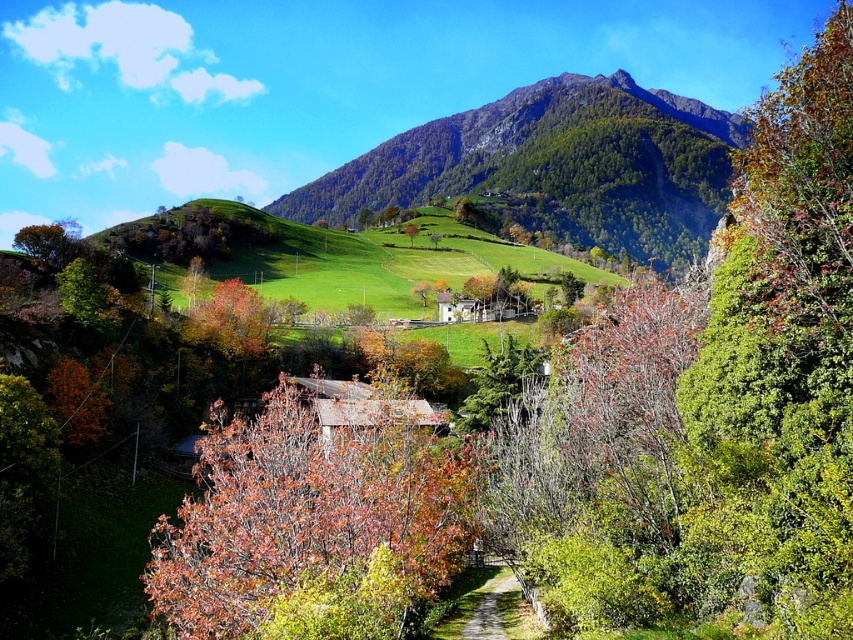
Is brown matte tree at center smaller than green grassy path at center?

Incorrect, brown matte tree at center is not smaller in size than green grassy path at center.

Between brown matte tree at center and green grassy path at center, which one has less height?

green grassy path at center is shorter.

Is point (357, 586) farther from viewer compared to point (495, 602)?

No, it is not.

This screenshot has height=640, width=853. Identify the location of brown matte tree at center. (312, 525).

Is point (73, 371) less distant than point (410, 224)?

Yes, it is in front of point (410, 224).

Is point (97, 387) positioned in front of point (410, 234)?

Yes.

You are a GUI agent. You are given a task and a screenshot of the screen. Output one action in this format:
    pyautogui.click(x=<x>, y=<y>)
    Task: Click on the orange matte tree at lower left
    This screenshot has width=853, height=640.
    Given the screenshot: What is the action you would take?
    pyautogui.click(x=76, y=403)

Is green grassy path at center closer to the viewer compared to green leafy tree at center?

Yes, green grassy path at center is closer to the viewer.

Between green grassy path at center and green leafy tree at center, which one has less height?

green grassy path at center is shorter.

This screenshot has height=640, width=853. In order to click on green grassy path at center in this screenshot , I will do `click(488, 614)`.

Where is `green grassy path at center`? This screenshot has height=640, width=853. green grassy path at center is located at coordinates (488, 614).